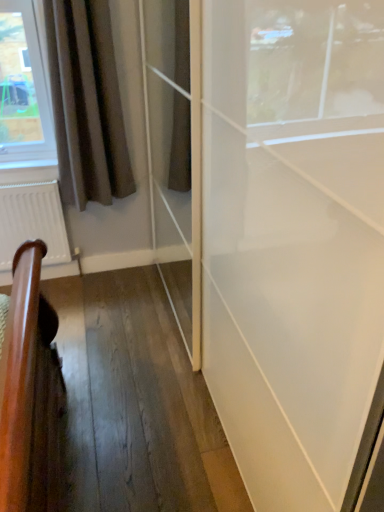
Question: Would you say brown fabric curtain at left contains white matte radiator at lower left?

Choices:
 (A) yes
 (B) no

Answer: (B)

Question: Does brown fabric curtain at left appear on the right side of white matte radiator at lower left?

Choices:
 (A) no
 (B) yes

Answer: (B)

Question: From a real-world perspective, is brown fabric curtain at left located higher than white matte radiator at lower left?

Choices:
 (A) no
 (B) yes

Answer: (B)

Question: From the image's perspective, is brown fabric curtain at left located above white matte radiator at lower left?

Choices:
 (A) yes
 (B) no

Answer: (A)

Question: Can you confirm if brown fabric curtain at left is thinner than white matte radiator at lower left?

Choices:
 (A) yes
 (B) no

Answer: (B)

Question: Is brown fabric curtain at left outside of white matte radiator at lower left?

Choices:
 (A) yes
 (B) no

Answer: (A)

Question: Is white matte radiator at lower left thinner than brown fabric curtain at left?

Choices:
 (A) yes
 (B) no

Answer: (A)

Question: Is white matte radiator at lower left shorter than brown fabric curtain at left?

Choices:
 (A) no
 (B) yes

Answer: (B)

Question: Is white matte radiator at lower left positioned beyond the bounds of brown fabric curtain at left?

Choices:
 (A) yes
 (B) no

Answer: (A)

Question: From the image's perspective, is white matte radiator at lower left over brown fabric curtain at left?

Choices:
 (A) yes
 (B) no

Answer: (B)

Question: Could you tell me if white matte radiator at lower left is facing brown fabric curtain at left?

Choices:
 (A) yes
 (B) no

Answer: (B)

Question: Is white matte radiator at lower left bigger than brown fabric curtain at left?

Choices:
 (A) yes
 (B) no

Answer: (B)

Question: From the image's perspective, is white matte radiator at lower left positioned above or below brown fabric curtain at left?

Choices:
 (A) below
 (B) above

Answer: (A)